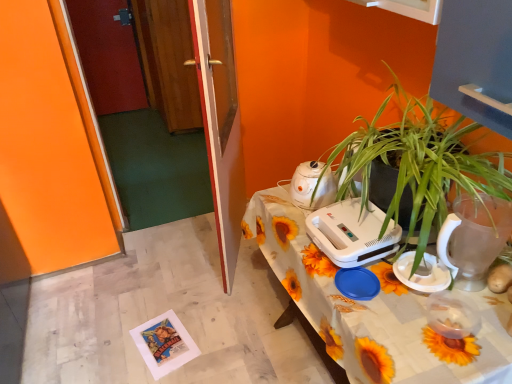
Question: Can you confirm if transparent glass door at center, which is the 1th glass door from front to back, is taller than green leafy plant at right?

Choices:
 (A) no
 (B) yes

Answer: (B)

Question: Does transparent glass door at center, which is the 1th glass door from front to back, contain green leafy plant at right?

Choices:
 (A) no
 (B) yes

Answer: (A)

Question: Is transparent glass door at center, which is the 1th glass door from front to back, further to the viewer compared to green leafy plant at right?

Choices:
 (A) no
 (B) yes

Answer: (B)

Question: Can you confirm if transparent glass door at center, which is the 1th glass door from front to back, is positioned to the left of green leafy plant at right?

Choices:
 (A) yes
 (B) no

Answer: (A)

Question: From a real-world perspective, is transparent glass door at center, which appears as the third glass door when viewed from the back, below green leafy plant at right?

Choices:
 (A) yes
 (B) no

Answer: (A)

Question: Is point (168, 109) positioned closer to the camera than point (492, 220)?

Choices:
 (A) farther
 (B) closer

Answer: (A)

Question: Based on their sizes in the image, would you say wooden door at left, which is the first glass door in back-to-front order, is bigger or smaller than transparent plastic pitcher at right, the 1th appliance when ordered from front to back?

Choices:
 (A) big
 (B) small

Answer: (A)

Question: Considering the positions of wooden door at left, which is the first glass door in back-to-front order, and transparent plastic pitcher at right, marked as the fourth appliance in a back-to-front arrangement, in the image, is wooden door at left, which is the first glass door in back-to-front order, taller or shorter than transparent plastic pitcher at right, marked as the fourth appliance in a back-to-front arrangement,?

Choices:
 (A) tall
 (B) short

Answer: (A)

Question: In the image, is wooden door at left, the 3th glass door from the front, positioned in front of or behind transparent plastic pitcher at right, the 1th appliance when ordered from front to back?

Choices:
 (A) front
 (B) behind

Answer: (B)

Question: Based on their positions, is transparent glass door at center, which is the 1th glass door from front to back, located to the left or right of transparent plastic pitcher at right, marked as the fourth appliance in a back-to-front arrangement?

Choices:
 (A) left
 (B) right

Answer: (A)

Question: In terms of height, does transparent glass door at center, which appears as the third glass door when viewed from the back, look taller or shorter compared to transparent plastic pitcher at right, marked as the fourth appliance in a back-to-front arrangement?

Choices:
 (A) short
 (B) tall

Answer: (B)

Question: Is transparent glass door at center, which appears as the third glass door when viewed from the back, inside or outside of transparent plastic pitcher at right, the 1th appliance when ordered from front to back?

Choices:
 (A) inside
 (B) outside

Answer: (B)

Question: Does point (217, 36) appear closer or farther from the camera than point (454, 205)?

Choices:
 (A) closer
 (B) farther

Answer: (B)

Question: Based on their positions, is wooden door at left, placed as the 2th glass door when sorted from back to front, located to the left or right of white plastic kettle at center, the 4th appliance viewed from the front?

Choices:
 (A) left
 (B) right

Answer: (A)

Question: From the image's perspective, is wooden door at left, which is the second glass door from front to back, above or below white plastic kettle at center, which is the 1th appliance in back-to-front order?

Choices:
 (A) above
 (B) below

Answer: (A)